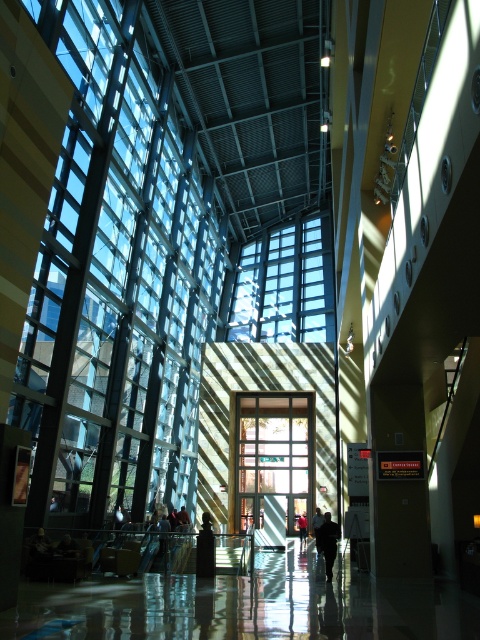
Question: Does red shirt at center appear on the left side of dark blue shirt at center?

Choices:
 (A) yes
 (B) no

Answer: (A)

Question: Can you confirm if dark gray jacket at center is positioned below dark blue shirt at center?

Choices:
 (A) no
 (B) yes

Answer: (A)

Question: Which object is positioned closest to the dark blue shirt at center?

Choices:
 (A) red shirt at center
 (B) dark gray jacket at center

Answer: (A)

Question: Among these points, which one is nearest to the camera?

Choices:
 (A) (335, 550)
 (B) (322, 518)

Answer: (A)

Question: Does dark gray jacket at center have a larger size compared to dark blue shirt at center?

Choices:
 (A) yes
 (B) no

Answer: (A)

Question: Among these points, which one is nearest to the camera?

Choices:
 (A) (300, 516)
 (B) (323, 547)
 (C) (321, 525)

Answer: (B)